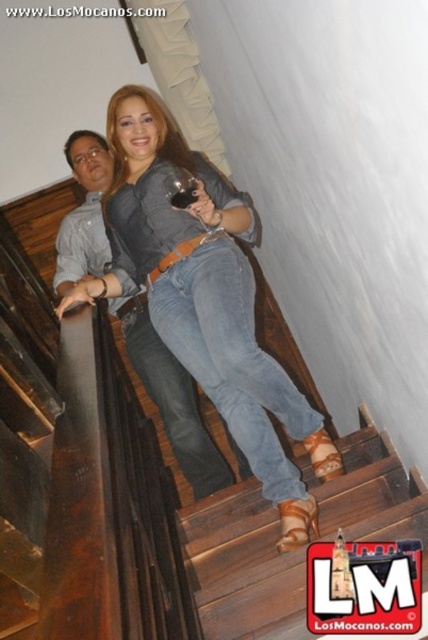
You are standing at the bottom of the staircase and want to place a small gift box exactly where the jeans at center are located. What are the coordinates where you should place the gift box?

The coordinates for the jeans at center are at point (232, 358), so you should place the gift box there.

You are an interior designer assessing the space in the image. You need to place a decorative item that is 1 meter wide. Which object between the brown wooden stairs at center and the brushed metal shirt at upper left can accommodate this item based on their sizes?

The brushed metal shirt at upper left can accommodate the 1 meter wide decorative item since it is larger than the brown wooden stairs at center.